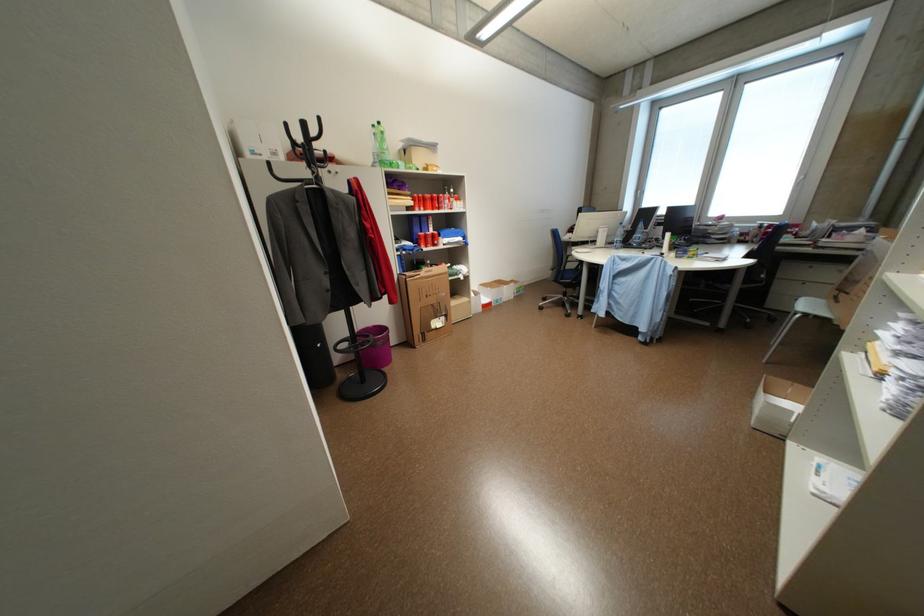
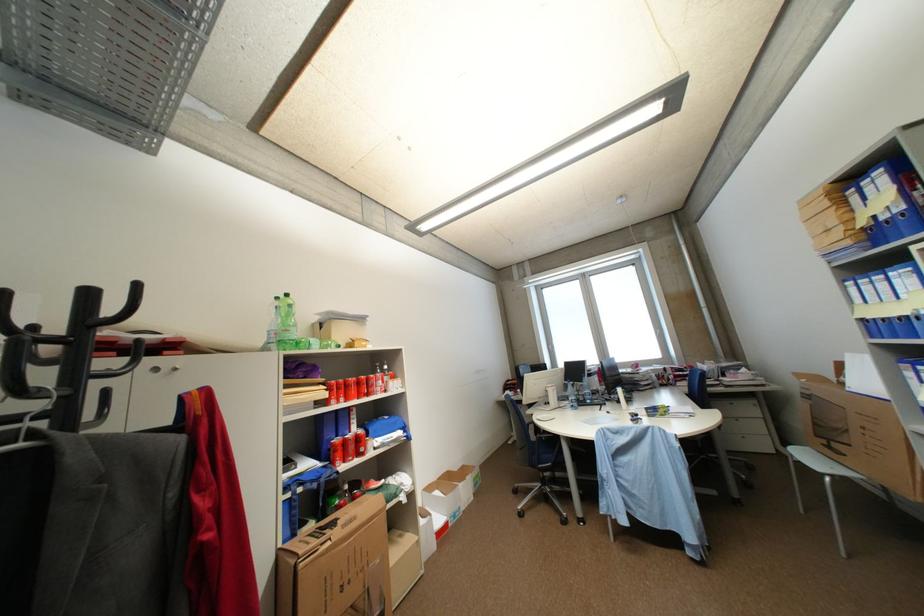
The point at [442,241] is marked in the first image. Where is the corresponding point in the second image?

(368, 447)